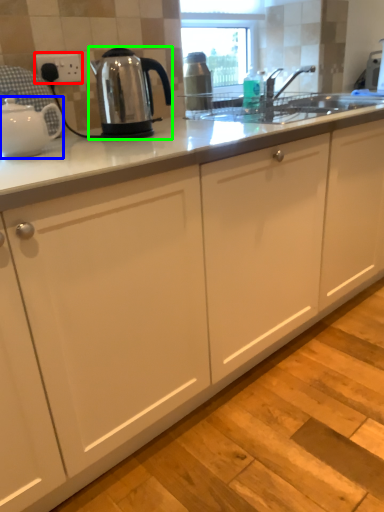
Question: Which object is the farthest from electric outlet (highlighted by a red box)? Choose among these: kettle (highlighted by a blue box) or kettle (highlighted by a green box).

Choices:
 (A) kettle
 (B) kettle

Answer: (A)